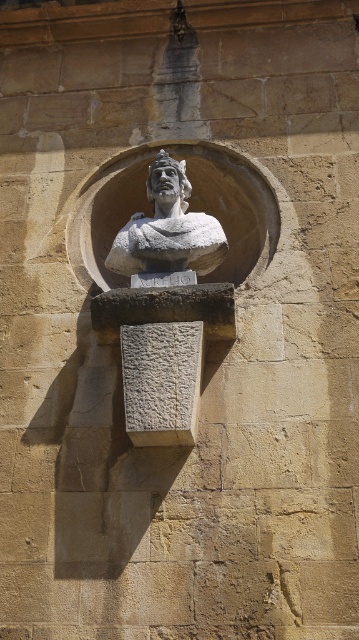
You are an art conservator examining the stone wall with both the white stone bust at center and the matte stone bust at center. Which bust is positioned lower on the wall?

The white stone bust at center is located below the matte stone bust at center, so it is positioned lower on the wall.

You are an art conservator assessing the stone busts in the image. The white stone bust at center and the matte stone bust at center are both in need of restoration. If you have a limited amount of restoration material, which bust would require more material due to its size?

The white stone bust at center requires more restoration material because it is bigger than the matte stone bust at center.

You are an art conservator examining the stone busts in the image. You notice two descriptions of the same bust. One is labeled as white stone bust at center and the other as matte stone bust at center. Which description is accurate based on the scene?

The scene describes the bust as white stone, so the accurate description is white stone bust at center.